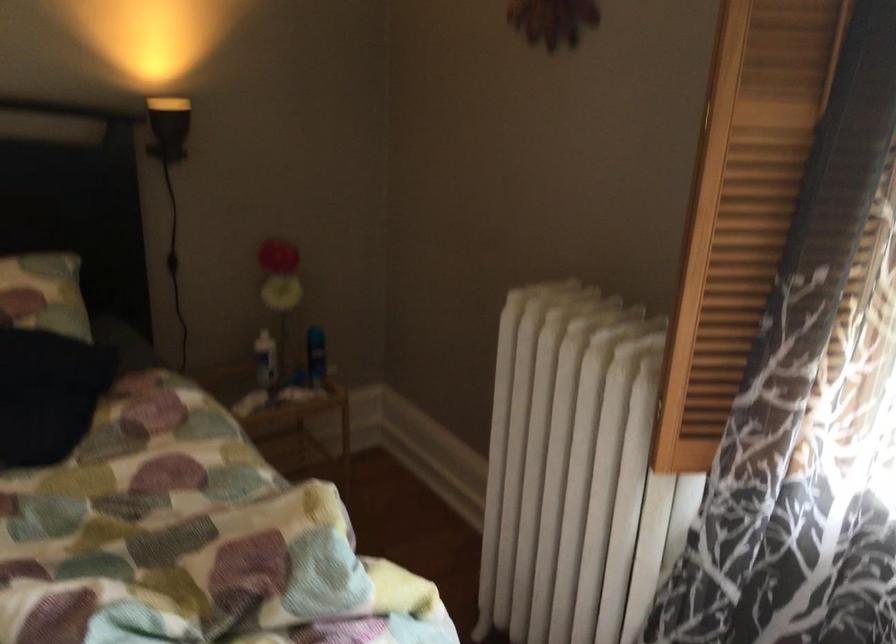
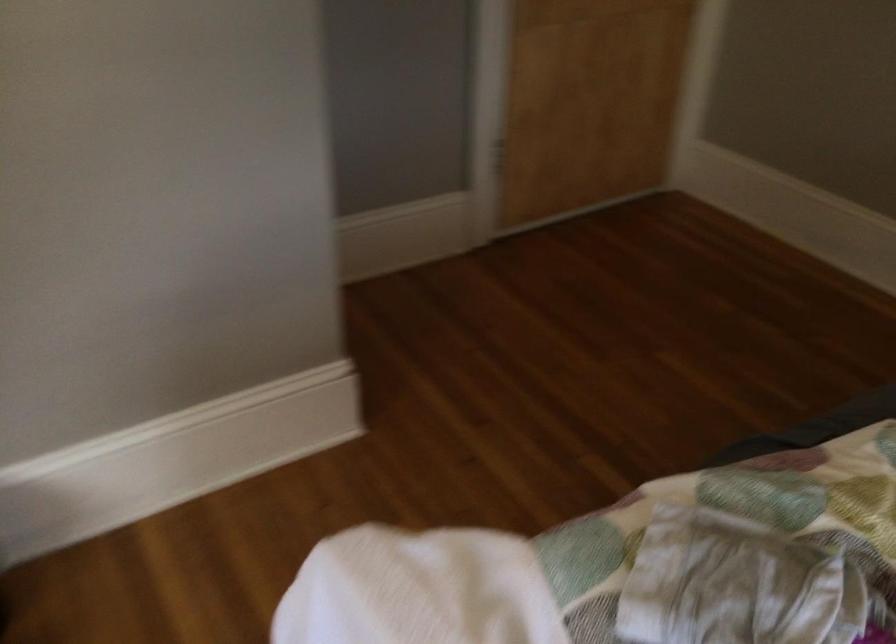
First-person continuous shooting, in which direction is the camera rotating?

The camera rotated toward left-down.